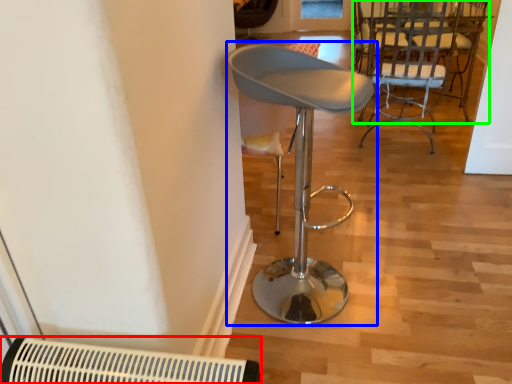
Question: Based on their relative distances, which object is farther from air conditioning (highlighted by a red box)? Choose from chair (highlighted by a blue box) and chair (highlighted by a green box).

Choices:
 (A) chair
 (B) chair

Answer: (B)